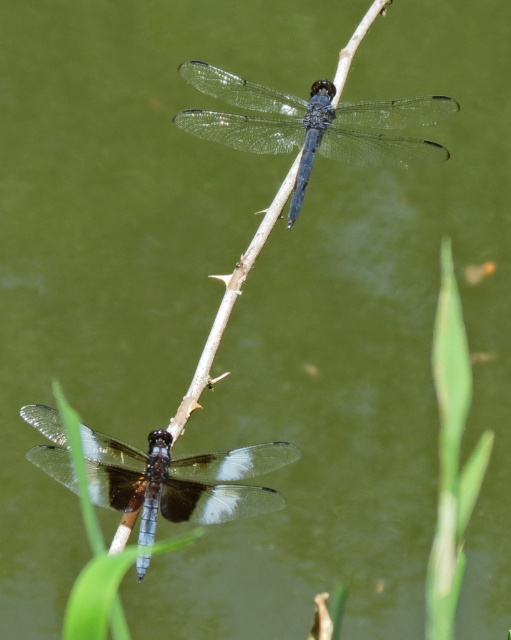
Can you confirm if transparent glass dragonfly at upper center is positioned to the right of translucent glass dragonfly at lower center?

Yes, transparent glass dragonfly at upper center is to the right of translucent glass dragonfly at lower center.

Can you confirm if transparent glass dragonfly at upper center is shorter than translucent glass dragonfly at lower center?

In fact, transparent glass dragonfly at upper center may be taller than translucent glass dragonfly at lower center.

This screenshot has width=511, height=640. Find the location of `transparent glass dragonfly at upper center`. transparent glass dragonfly at upper center is located at coordinates (312, 124).

The height and width of the screenshot is (640, 511). What are the coordinates of `transparent glass dragonfly at upper center` in the screenshot? It's located at coord(312,124).